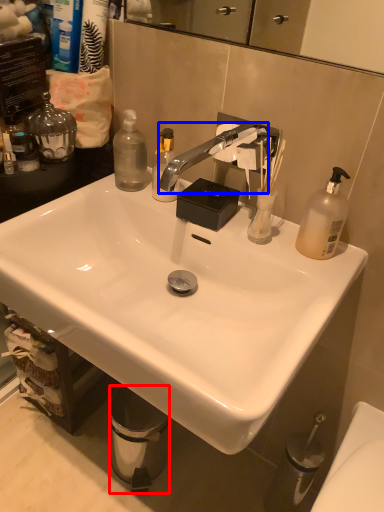
Question: Which point is closer to the camera, trash bin/can (highlighted by a red box) or faucet (highlighted by a blue box)?

Choices:
 (A) trash bin/can
 (B) faucet

Answer: (B)